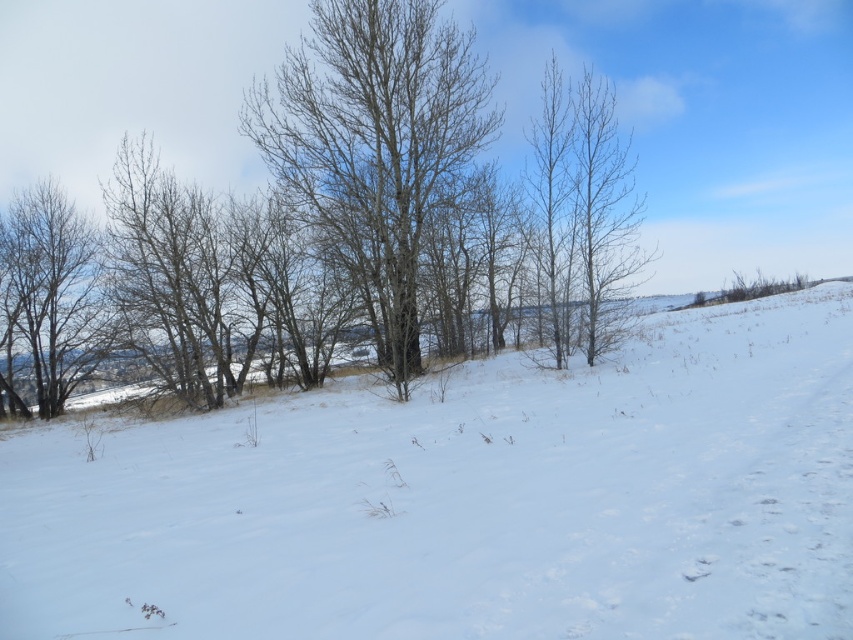
Can you confirm if snowy white ski slope at center is taller than bare branches at center?

Incorrect, snowy white ski slope at center's height is not larger of bare branches at center's.

Does snowy white ski slope at center lie in front of bare branches at center?

Yes.

Measure the distance between point (346,474) and camera.

Point (346,474) and camera are 9.82 meters apart.

The height and width of the screenshot is (640, 853). Identify the location of snowy white ski slope at center. (466, 499).

Between snowy white ski slope at center and brown bark tree at left, which one is positioned lower?

snowy white ski slope at center is below.

Does snowy white ski slope at center have a smaller size compared to brown bark tree at left?

No, snowy white ski slope at center is not smaller than brown bark tree at left.

Is point (674, 499) closer to viewer compared to point (64, 336)?

Yes, point (674, 499) is closer to viewer.

This screenshot has width=853, height=640. What are the coordinates of `snowy white ski slope at center` in the screenshot? It's located at (466, 499).

Which is below, bare branches at center or bare wood tree at center?

Positioned lower is bare wood tree at center.

Between bare branches at center and bare wood tree at center, which one appears on the right side from the viewer's perspective?

bare wood tree at center

Is point (67, 260) positioned before point (358, 86)?

No, it is not.

Image resolution: width=853 pixels, height=640 pixels. Identify the location of bare branches at center. (132, 86).